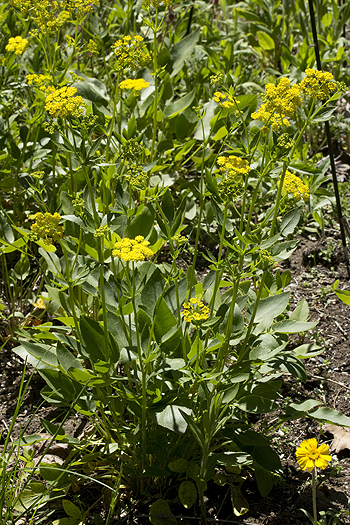
Where is `subject plant`? subject plant is located at coordinates (144, 312).